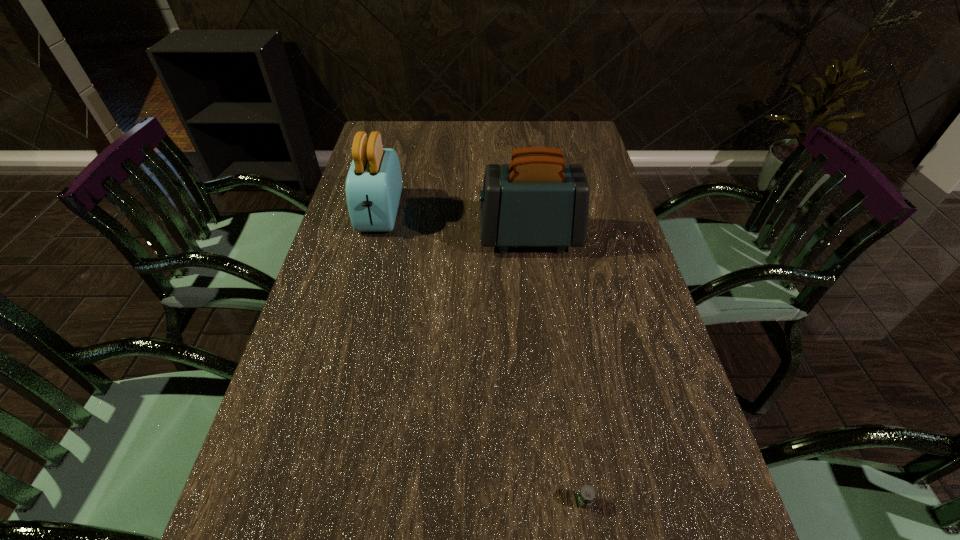
You are a GUI agent. You are given a task and a screenshot of the screen. Output one action in this format:
    pyautogui.click(x=<x>, y=<y>)
    Task: Click on the free space that satisfies the following two spatial constraints: 1. on the side of the nearest object with the lever; 2. on the right side of the leftmost object
    The width and height of the screenshot is (960, 540).
    Given the screenshot: What is the action you would take?
    pyautogui.click(x=307, y=501)

The height and width of the screenshot is (540, 960). I want to click on free point that satisfies the following two spatial constraints: 1. on the side of the left toaster with the lever; 2. on the left side of the nearest object, so click(x=307, y=501).

Where is `vacant region that satisfies the following two spatial constraints: 1. on the front-facing side of the shortest object; 2. on the right side of the right toaster`? vacant region that satisfies the following two spatial constraints: 1. on the front-facing side of the shortest object; 2. on the right side of the right toaster is located at coordinates (561, 501).

You are a GUI agent. You are given a task and a screenshot of the screen. Output one action in this format:
    pyautogui.click(x=<x>, y=<y>)
    Task: Click on the free point that satisfies the following two spatial constraints: 1. on the front-facing side of the right toaster; 2. on the right side of the nearest object
    
    Given the screenshot: What is the action you would take?
    pyautogui.click(x=561, y=501)

In order to click on vacant region that satisfies the following two spatial constraints: 1. on the front-facing side of the shortest object; 2. on the right side of the right toaster in this screenshot , I will do `click(561, 501)`.

Find the location of a particular element. Image resolution: width=960 pixels, height=540 pixels. vacant region that satisfies the following two spatial constraints: 1. on the back side of the beer can; 2. on the front-facing side of the right toaster is located at coordinates (543, 237).

Locate an element on the screen. Image resolution: width=960 pixels, height=540 pixels. vacant position in the image that satisfies the following two spatial constraints: 1. on the side of the left toaster with the lever; 2. on the left side of the beer can is located at coordinates coord(307,501).

The image size is (960, 540). I want to click on vacant point that satisfies the following two spatial constraints: 1. on the front-facing side of the right toaster; 2. on the back side of the nearest object, so click(561, 501).